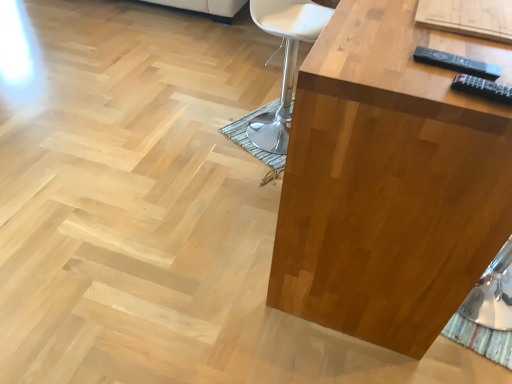
Question: In the image, is black plastic remote at upper right, which appears as the second remote when viewed from the front, positioned in front of or behind white leather chair at center?

Choices:
 (A) front
 (B) behind

Answer: (A)

Question: Based on their sizes in the image, would you say black plastic remote at upper right, which appears as the second remote when viewed from the front, is bigger or smaller than white leather chair at center?

Choices:
 (A) small
 (B) big

Answer: (A)

Question: Estimate the real-world distances between objects in this image. Which object is closer to the black plastic remote at upper right, the second remote from the top?

Choices:
 (A) black plastic remote at upper right, which appears as the second remote when viewed from the front
 (B) satin wood table at right
 (C) white leather chair at center

Answer: (A)

Question: Based on their relative distances, which object is farther from the satin wood table at right?

Choices:
 (A) black plastic remote at upper right, arranged as the first remote when ordered from the bottom
 (B) black plastic remote at upper right, the first remote in the top-to-bottom sequence
 (C) white leather chair at center

Answer: (C)